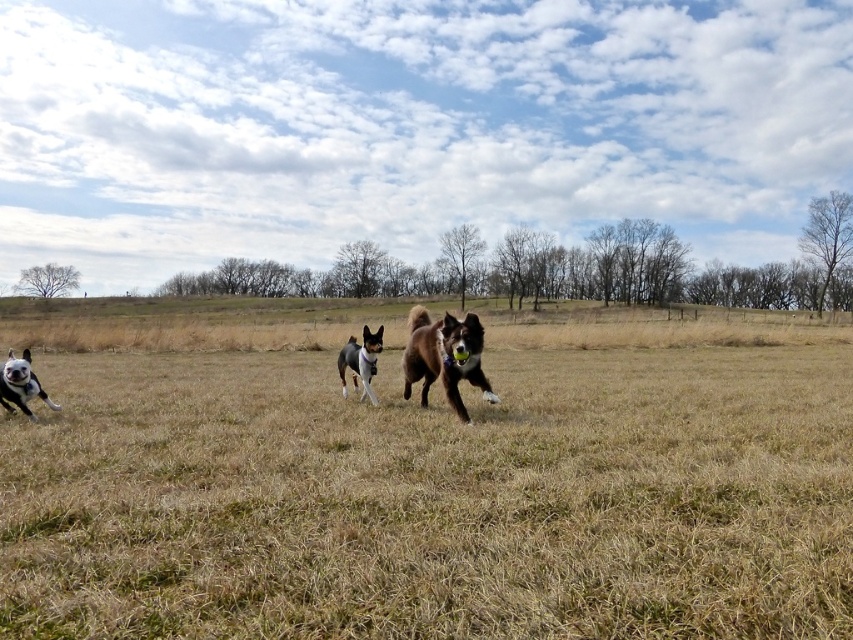
Can you confirm if brown furry dog at center is shorter than smooth brown dog at center?

Yes, brown furry dog at center is shorter than smooth brown dog at center.

The height and width of the screenshot is (640, 853). What do you see at coordinates (444, 356) in the screenshot?
I see `brown furry dog at center` at bounding box center [444, 356].

You are a GUI agent. You are given a task and a screenshot of the screen. Output one action in this format:
    pyautogui.click(x=<x>, y=<y>)
    Task: Click on the brown furry dog at center
    The image size is (853, 640).
    Given the screenshot: What is the action you would take?
    click(444, 356)

Is brown grass at center to the left of white glossy dog at lower left from the viewer's perspective?

Yes, brown grass at center is to the left of white glossy dog at lower left.

The width and height of the screenshot is (853, 640). In order to click on brown grass at center in this screenshot , I will do `click(426, 477)`.

Is white glossy dog at lower left further to camera compared to smooth brown dog at center?

That is False.

Which of these two, white glossy dog at lower left or smooth brown dog at center, stands taller?

With more height is smooth brown dog at center.

I want to click on white glossy dog at lower left, so click(x=20, y=385).

I want to click on white glossy dog at lower left, so click(20, 385).